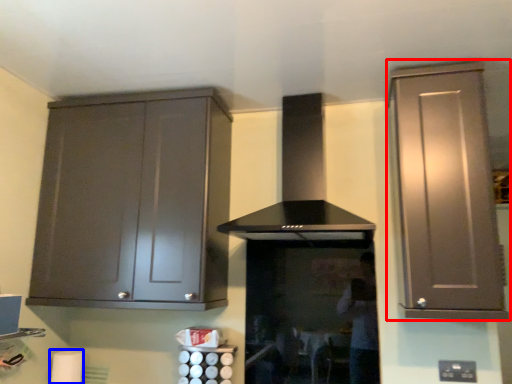
Question: Which point is further to the camera, cabinetry (highlighted by a red box) or toilet paper (highlighted by a blue box)?

Choices:
 (A) cabinetry
 (B) toilet paper

Answer: (B)